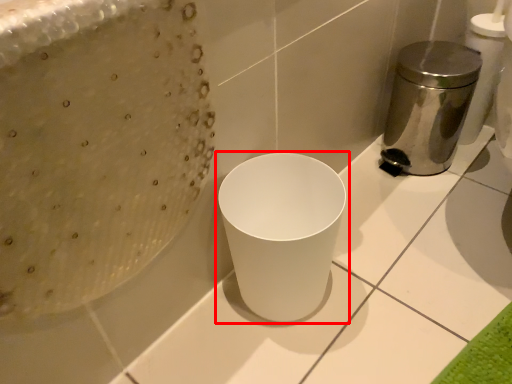
Question: Considering the relative positions of waste container (annotated by the red box) and appliance in the image provided, where is waste container (annotated by the red box) located with respect to the staircase?

Choices:
 (A) right
 (B) left

Answer: (B)